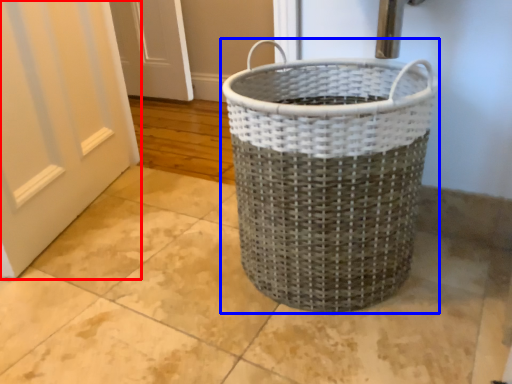
Question: Which point is closer to the camera, door (highlighted by a red box) or waste container (highlighted by a blue box)?

Choices:
 (A) door
 (B) waste container

Answer: (B)